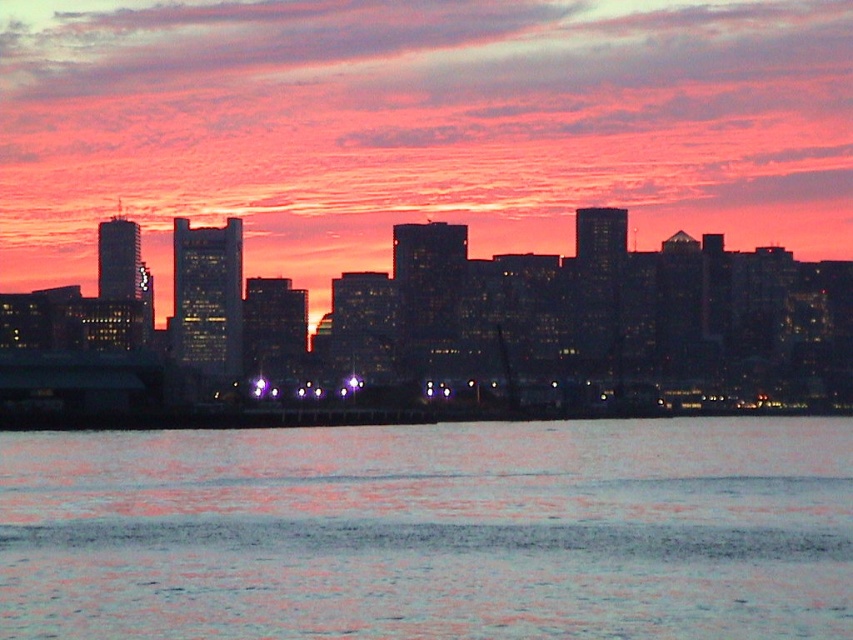
You are a photographer planning to capture the sunset reflection on the reflective silver water at lower center and the black glass buildings at center. Given that the water is smaller in size, how might this affect your composition?

The reflective silver water at lower center has a smaller size compared to black glass buildings at center, so the water reflection will occupy less space in the frame, potentially making the buildings the dominant focus while the water serves as a complementary element.

You are standing in the city and looking at the skyline. You notice two points in the scene, one at point coordinates point (381, 612) and another at point coordinates point (256, 356). Which point is closer to you?

Point (381, 612) is further to the viewer than point (256, 356), so the closer point is point (256, 356).

From the picture: You are a photographer planning to capture the sunset reflection in the water. Given that the reflective silver water at lower center is much taller than the black glass buildings at center, how does the water appear in relation to the buildings?

The reflective silver water at lower center appears taller than the black glass buildings at center, meaning it extends higher up in the image compared to the buildings.